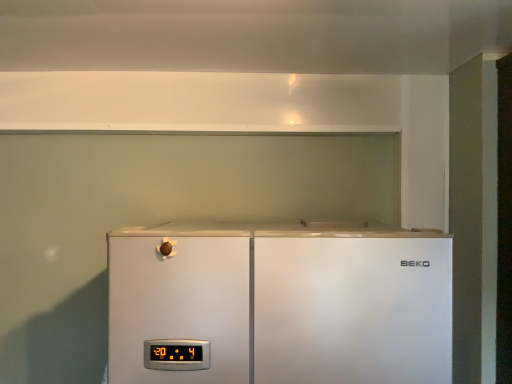
What is the approximate width of satin white refrigerator at center?

satin white refrigerator at center is 78.12 centimeters in width.

Identify the location of satin white refrigerator at center. (279, 305).

The height and width of the screenshot is (384, 512). What do you see at coordinates (279, 305) in the screenshot?
I see `satin white refrigerator at center` at bounding box center [279, 305].

Locate an element on the screen. satin white refrigerator at center is located at coordinates (279, 305).